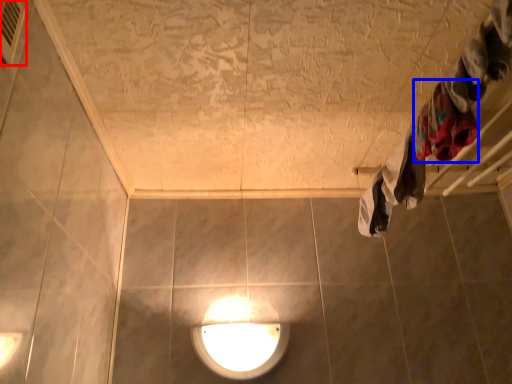
Question: Which object is further to the camera taking this photo, air conditioner (highlighted by a red box) or clothing (highlighted by a blue box)?

Choices:
 (A) air conditioner
 (B) clothing

Answer: (B)